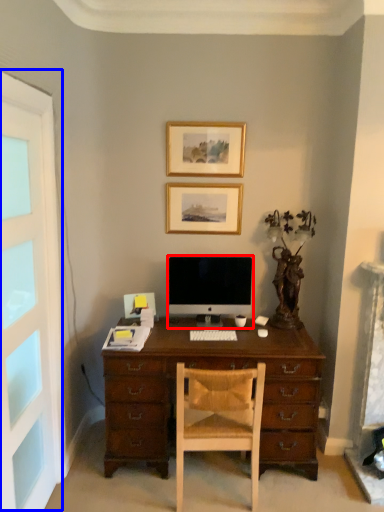
Question: Which point is further to the camera, computer monitor (highlighted by a red box) or screen door (highlighted by a blue box)?

Choices:
 (A) computer monitor
 (B) screen door

Answer: (A)